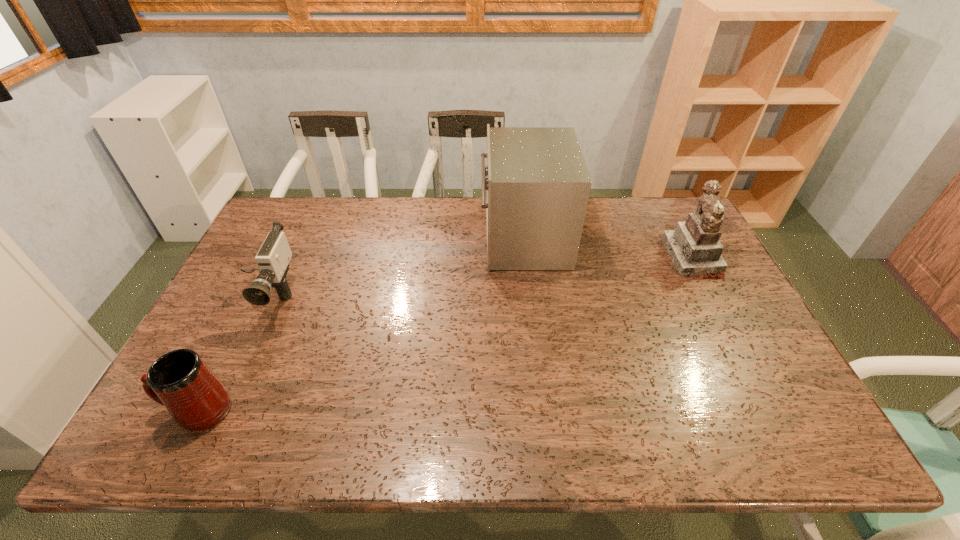
Locate an element on the screen. the second object from right to left is located at coordinates (537, 184).

Identify the location of toaster oven. This screenshot has width=960, height=540. (537, 184).

Where is `figurine`? figurine is located at coordinates (694, 247).

The height and width of the screenshot is (540, 960). What are the coordinates of `the third shortest object` in the screenshot? It's located at (694, 247).

Find the location of a particular element. Image resolution: width=960 pixels, height=540 pixels. camcorder is located at coordinates (273, 257).

Image resolution: width=960 pixels, height=540 pixels. I want to click on mug, so click(180, 380).

Where is `vacant space situated 0.100m on the front panel of the toaster oven`? This screenshot has height=540, width=960. vacant space situated 0.100m on the front panel of the toaster oven is located at coordinates (450, 239).

The width and height of the screenshot is (960, 540). Identify the location of vacant space located 0.190m on the front panel of the toaster oven. click(x=423, y=239).

Identify the location of free space located 0.220m on the front panel of the toaster oven. (415, 239).

Identify the location of free spot located on the front-facing side of the rightmost object. The width and height of the screenshot is (960, 540). [x=589, y=258].